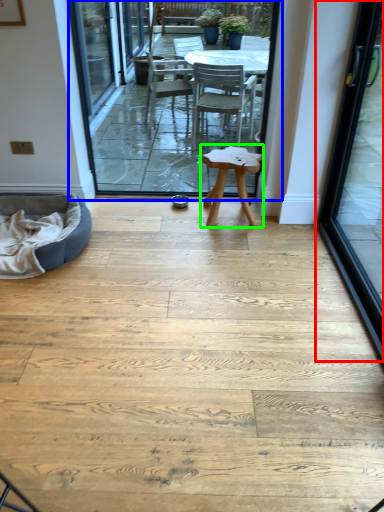
Question: Which is nearer to the door (highlighted by a red box)? terrace (highlighted by a blue box) or stool (highlighted by a green box).

Choices:
 (A) terrace
 (B) stool

Answer: (B)